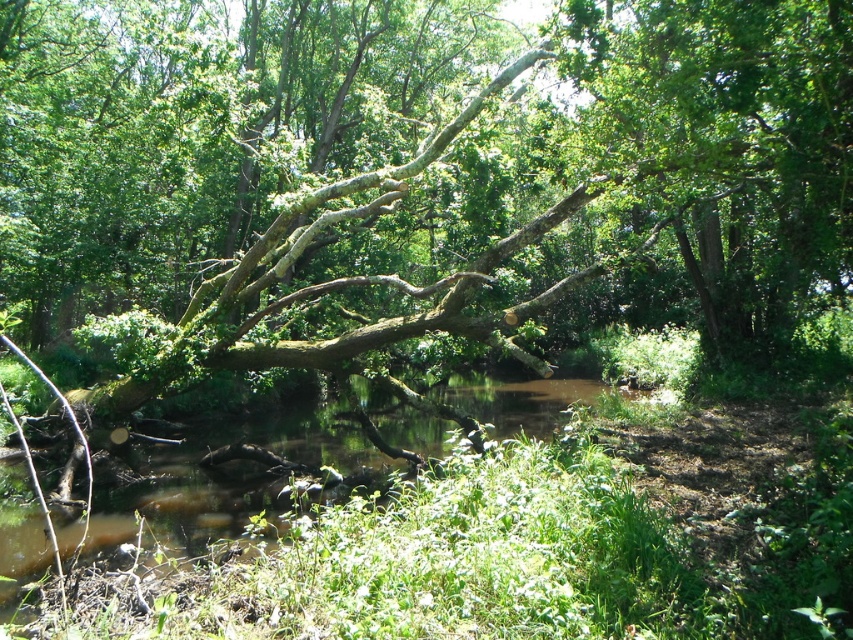
Question: Is green mossy branch at center in front of brown muddy water at center?

Choices:
 (A) yes
 (B) no

Answer: (B)

Question: Based on their relative distances, which object is nearer to the green mossy branch at center?

Choices:
 (A) green leafy tree at upper right
 (B) brown muddy water at center

Answer: (B)

Question: Which of the following is the farthest from the observer?

Choices:
 (A) green mossy branch at center
 (B) green leafy tree at upper right

Answer: (A)

Question: Considering the real-world distances, which object is farthest from the green mossy branch at center?

Choices:
 (A) green leafy tree at upper right
 (B) brown muddy water at center

Answer: (A)

Question: Can you confirm if green mossy branch at center is positioned above green leafy tree at upper right?

Choices:
 (A) no
 (B) yes

Answer: (B)

Question: Does green mossy branch at center have a smaller size compared to brown muddy water at center?

Choices:
 (A) yes
 (B) no

Answer: (B)